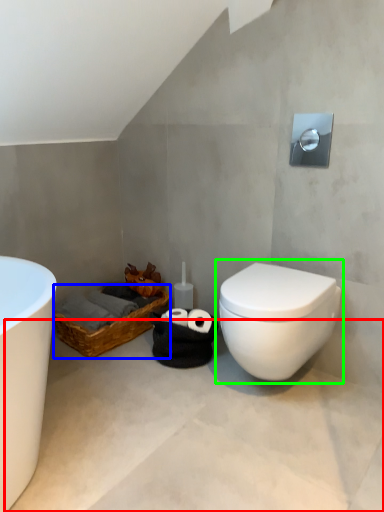
Question: Which object is the farthest from concrete (highlighted by a red box)? Choose among these: basket (highlighted by a blue box) or toilet (highlighted by a green box).

Choices:
 (A) basket
 (B) toilet

Answer: (A)